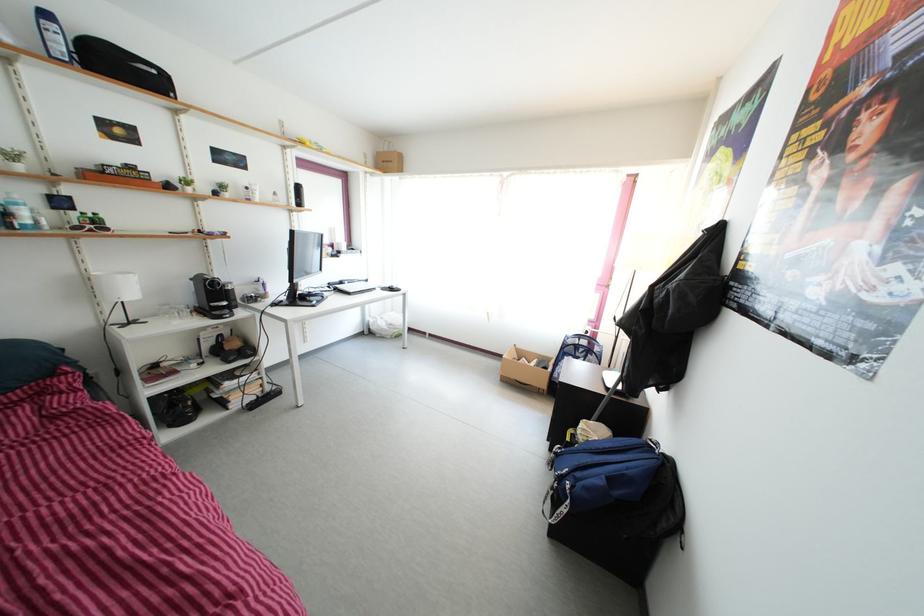
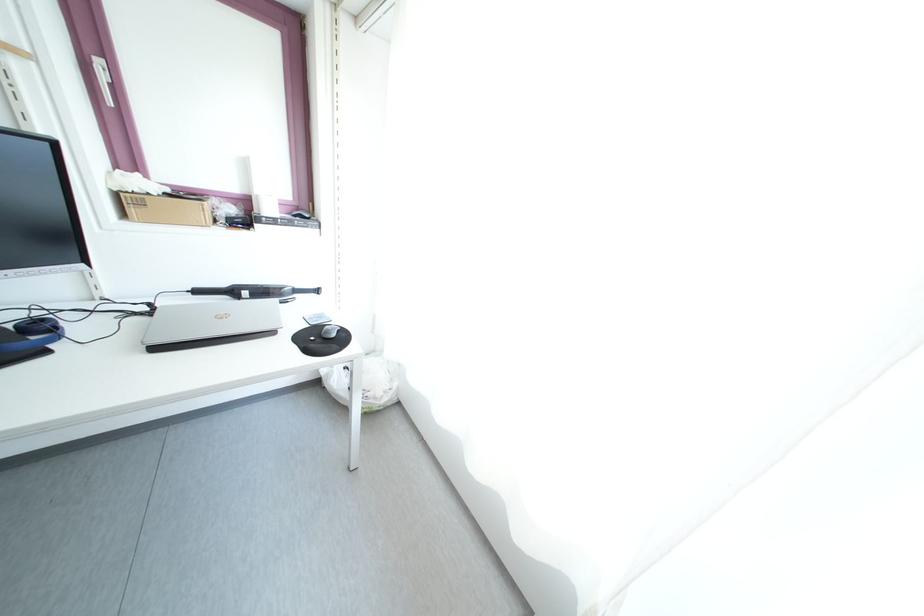
Question: Which direction would the cameraman need to move to produce the second image? Reply with the corresponding letter.

Choices:
 (A) Left
 (B) Right
 (C) Forward
 (D) Backward

Answer: (C)